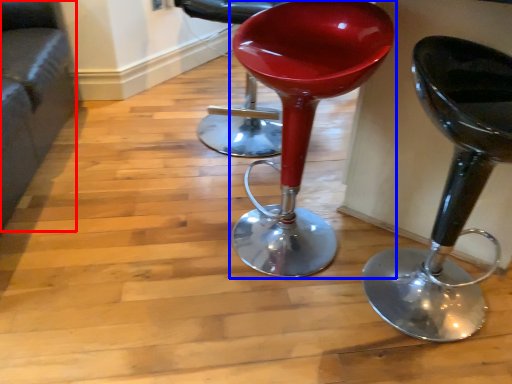
Question: Among these objects, which one is nearest to the camera, couch (highlighted by a red box) or stool (highlighted by a blue box)?

Choices:
 (A) couch
 (B) stool

Answer: (A)